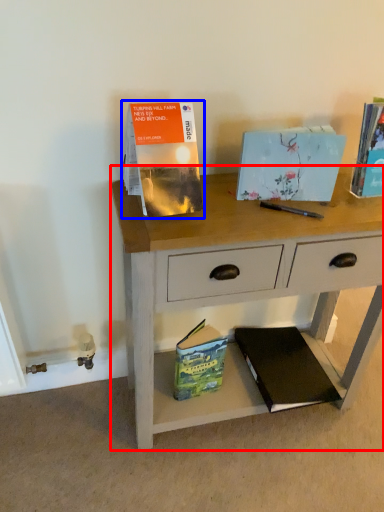
Question: Which of the following is the farthest to the observer, desk (highlighted by a red box) or paperback book (highlighted by a blue box)?

Choices:
 (A) desk
 (B) paperback book

Answer: (A)